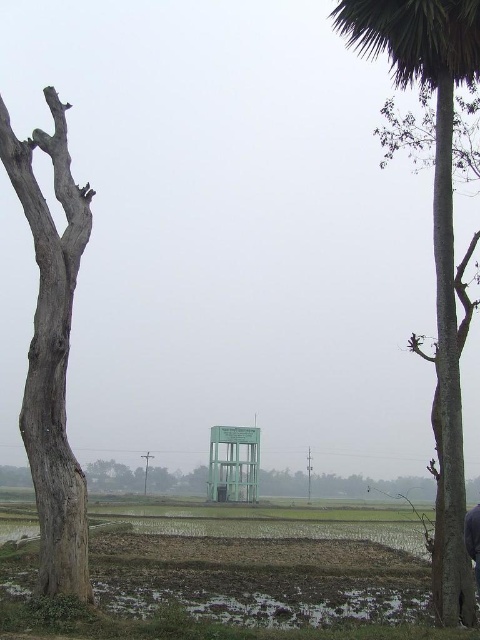
Which is more to the right, gray rough bark tree at left or muddy wet field at lower center?

From the viewer's perspective, muddy wet field at lower center appears more on the right side.

The image size is (480, 640). Identify the location of gray rough bark tree at left. (51, 352).

At what (x,y) coordinates should I click in order to perform the action: click on gray rough bark tree at left. Please return your answer as a coordinate pair (x, y). This screenshot has width=480, height=640. Looking at the image, I should click on (51, 352).

Between green leafy palm tree at right and muddy wet field at lower center, which one appears on the left side from the viewer's perspective?

From the viewer's perspective, muddy wet field at lower center appears more on the left side.

Who is lower down, green leafy palm tree at right or muddy wet field at lower center?

Result: muddy wet field at lower center is lower down.

What are the coordinates of `green leafy palm tree at right` in the screenshot? It's located at (433, 236).

Is green leafy palm tree at right bigger than gray rough bark tree at left?

Yes, green leafy palm tree at right is bigger than gray rough bark tree at left.

Is green leafy palm tree at right behind gray rough bark tree at left?

Yes, it is.

Find the location of a particular element. green leafy palm tree at right is located at coordinates (433, 236).